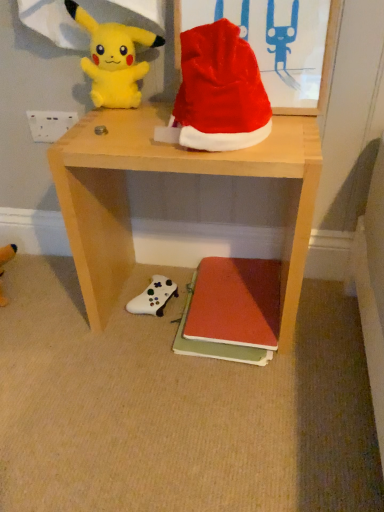
The width and height of the screenshot is (384, 512). Find the location of `free location in front of yellow plush toy at upper left, acting as the 2th toy starting from the bottom`. free location in front of yellow plush toy at upper left, acting as the 2th toy starting from the bottom is located at coordinates (121, 123).